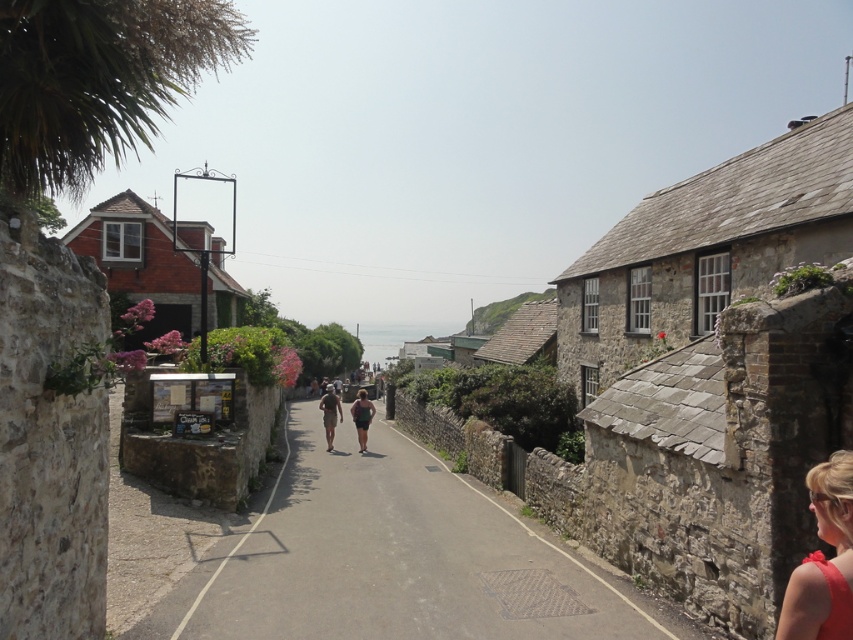
You are a tourist walking along the street and want to take a photo of the matte red dress at lower right while also including the stone paved alley at center in the frame. Based on their positions, will you need to adjust your camera angle upwards or downwards to capture both in the same shot?

The stone paved alley at center is located below the matte red dress at lower right, so to include both in the same frame, you would need to angle your camera upwards to capture the dress above and the alley below.

You are a delivery person carrying a box that requires a clear path of at least 8 meters to maneuver safely. You see the stone paved alley at center and the matte red dress at lower right. Can you safely navigate through the space between them?

The distance between the stone paved alley at center and the matte red dress at lower right is 8.47 meters, which is more than the required 8 meters. Therefore, you can safely navigate through the space between them.